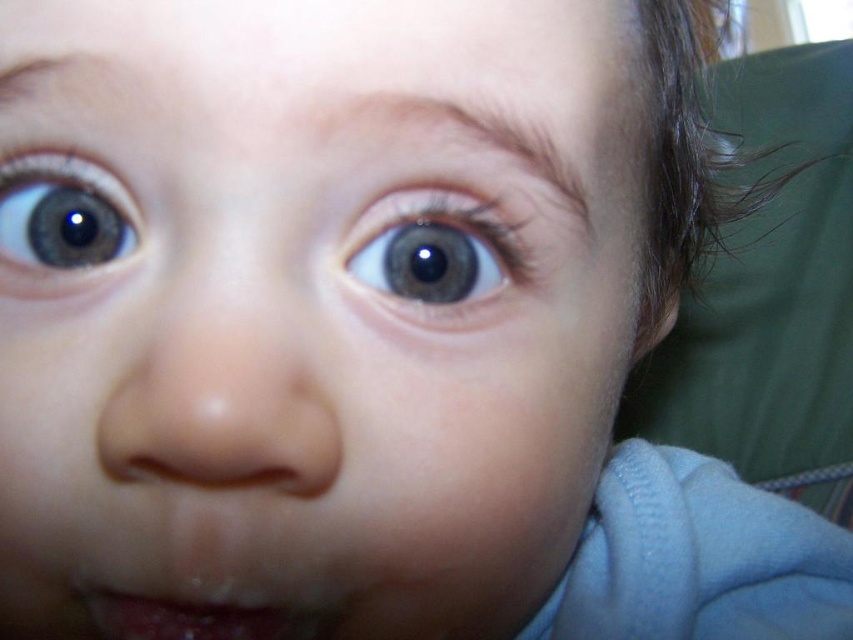
Is blue glossy eye at center above matte brown eye at upper left?

Actually, blue glossy eye at center is below matte brown eye at upper left.

Which is below, blue glossy eye at center or matte brown eye at upper left?

blue glossy eye at center

Who is more forward, (408,230) or (88,166)?

Point (88,166)

You are a GUI agent. You are given a task and a screenshot of the screen. Output one action in this format:
    pyautogui.click(x=<x>, y=<y>)
    Task: Click on the blue glossy eye at center
    Image resolution: width=853 pixels, height=640 pixels.
    Given the screenshot: What is the action you would take?
    pyautogui.click(x=434, y=252)

Who is more forward, (26, 214) or (192, 628)?

Point (192, 628) is in front.

Can you confirm if matte brown eye at upper left is shorter than dry matte lips at lower center?

In fact, matte brown eye at upper left may be taller than dry matte lips at lower center.

You are a GUI agent. You are given a task and a screenshot of the screen. Output one action in this format:
    pyautogui.click(x=<x>, y=<y>)
    Task: Click on the matte brown eye at upper left
    The height and width of the screenshot is (640, 853).
    Given the screenshot: What is the action you would take?
    pyautogui.click(x=62, y=218)

You are a GUI agent. You are given a task and a screenshot of the screen. Output one action in this format:
    pyautogui.click(x=<x>, y=<y>)
    Task: Click on the matte brown eye at upper left
    This screenshot has height=640, width=853.
    Given the screenshot: What is the action you would take?
    pyautogui.click(x=62, y=218)

Is point (384, 298) positioned before point (134, 620)?

Yes.

Can you confirm if blue glossy eye at center is smaller than dry matte lips at lower center?

No.

Find the location of `blue glossy eye at center`. blue glossy eye at center is located at coordinates coord(434,252).